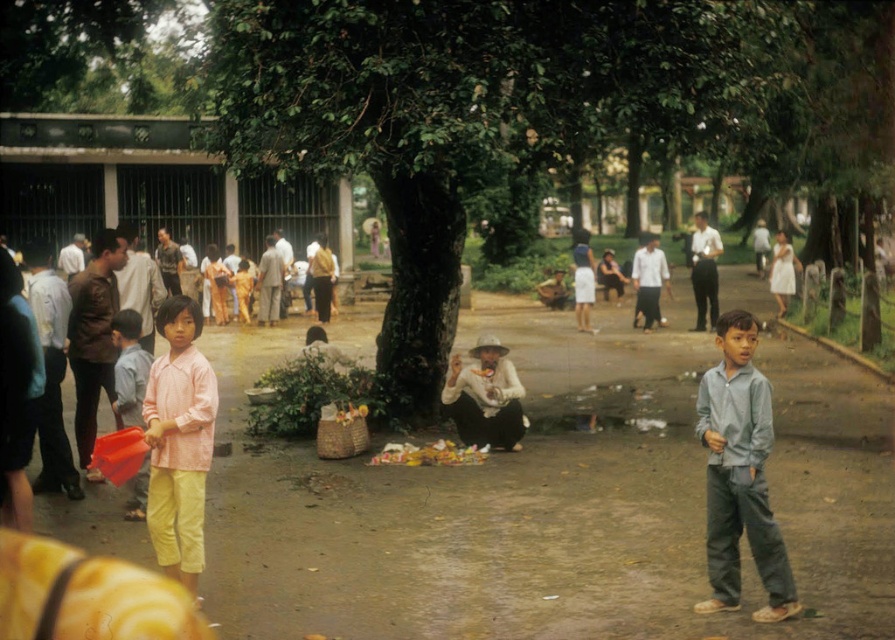
You are organizing a clothing display and need to place the pink woven shirt at center and the matte pink shirt at left side by side. Which shirt should you place on the left to ensure they fit within a 1.5 meter wide display area?

The matte pink shirt at left has a smaller width compared to the pink woven shirt at center. To fit within the 1.5 meter display area, place the wider pink woven shirt at center on the left and the narrower matte pink shirt at left on the right, ensuring they align with the available space.

You are a photographer trying to capture both the pink woven shirt at center and the matte pink shirt at left in a single frame. Since you can only focus on one subject at a time, which one should you focus on first to ensure the other remains in the background?

The pink woven shirt at center is to the right of matte pink shirt at left, so focusing on the pink woven shirt at center first would keep the matte pink shirt at left in the background.

You are a photographer trying to capture both the green leafy tree at center and the pink woven shirt at center in a single frame. Based on their sizes, which object should you focus on to ensure both fit comfortably in the photo?

Answer: The green leafy tree at center is wider than the pink woven shirt at center, so you should focus on the tree to ensure both fit comfortably in the photo.